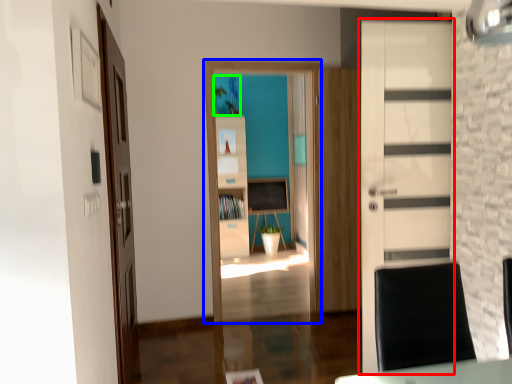
Question: Based on their relative distances, which object is nearer to door (highlighted by a red box)? Choose from entertainment center (highlighted by a blue box) and plant (highlighted by a green box).

Choices:
 (A) entertainment center
 (B) plant

Answer: (A)